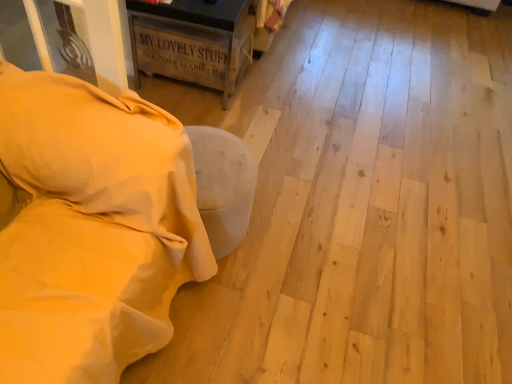
The width and height of the screenshot is (512, 384). I want to click on spots to the right of beige fabric ottoman at lower left, the first furniture in the front-to-back sequence, so click(275, 297).